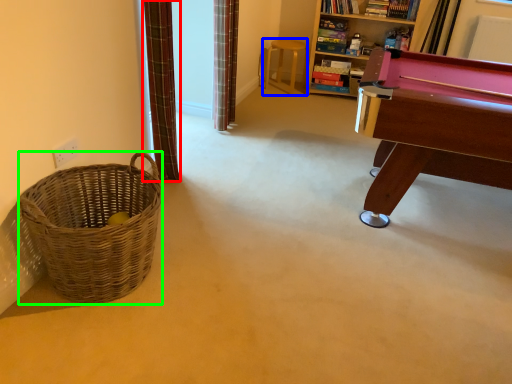
Question: Considering the real-world distances, which object is closest to curtain (highlighted by a red box)? stool (highlighted by a blue box) or basket (highlighted by a green box).

Choices:
 (A) stool
 (B) basket

Answer: (B)